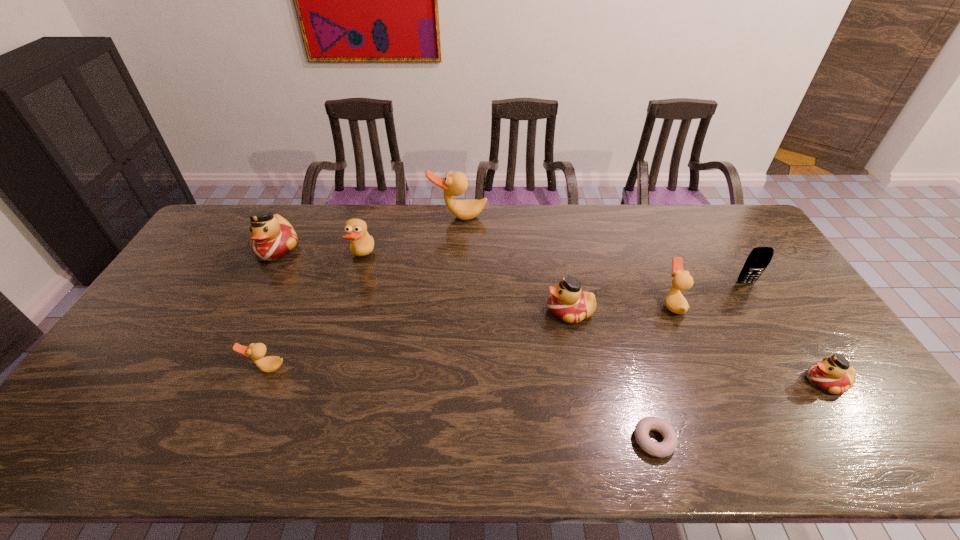
You are a GUI agent. You are given a task and a screenshot of the screen. Output one action in this format:
    pyautogui.click(x=<x>, y=<y>)
    Task: Click on the blank space located 0.140m on the screen of the cellular telephone
    This screenshot has width=960, height=540.
    Given the screenshot: What is the action you would take?
    pyautogui.click(x=768, y=319)

Image resolution: width=960 pixels, height=540 pixels. I want to click on free location located 0.090m on the face of the second red duck from right to left, so click(516, 312).

You are a GUI agent. You are given a task and a screenshot of the screen. Output one action in this format:
    pyautogui.click(x=<x>, y=<y>)
    Task: Click on the free spot located 0.160m on the face of the second red duck from right to left
    The height and width of the screenshot is (540, 960).
    Given the screenshot: What is the action you would take?
    pyautogui.click(x=492, y=312)

This screenshot has width=960, height=540. I want to click on free spot located on the face of the second red duck from right to left, so click(433, 312).

Where is `free point located 0.250m on the beak of the rightmost tan duck`? free point located 0.250m on the beak of the rightmost tan duck is located at coordinates (580, 304).

You are a GUI agent. You are given a task and a screenshot of the screen. Output one action in this format:
    pyautogui.click(x=<x>, y=<y>)
    Task: Click on the free point located 0.130m on the beak of the rightmost tan duck
    Image resolution: width=960 pixels, height=540 pixels.
    Given the screenshot: What is the action you would take?
    pyautogui.click(x=619, y=304)

I want to click on free space located 0.330m on the beak of the rightmost tan duck, so click(x=554, y=304).

Locate an element on the screen. The width and height of the screenshot is (960, 540). free space located 0.100m on the face of the nearest red duck is located at coordinates [766, 382].

This screenshot has height=540, width=960. Find the location of `vacant region located on the face of the nearest red duck`. vacant region located on the face of the nearest red duck is located at coordinates (778, 382).

Image resolution: width=960 pixels, height=540 pixels. In order to click on vacant space situated on the face of the nearest red duck in this screenshot , I will do `click(690, 382)`.